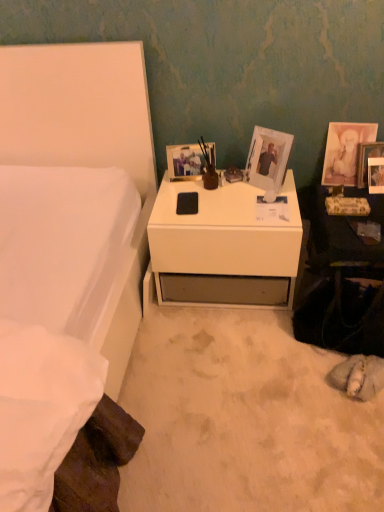
You are a GUI agent. You are given a task and a screenshot of the screen. Output one action in this format:
    pyautogui.click(x=<x>, y=<y>)
    Task: Click on the vacant area on top of white matte desk at center (from a real-world perspective)
    
    Given the screenshot: What is the action you would take?
    pyautogui.click(x=219, y=189)